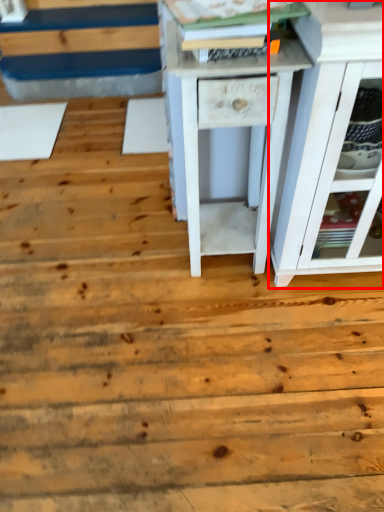
Question: From the image, what is the correct spatial relationship of chest of drawers (annotated by the red box) in relation to nightstand?

Choices:
 (A) right
 (B) left

Answer: (A)